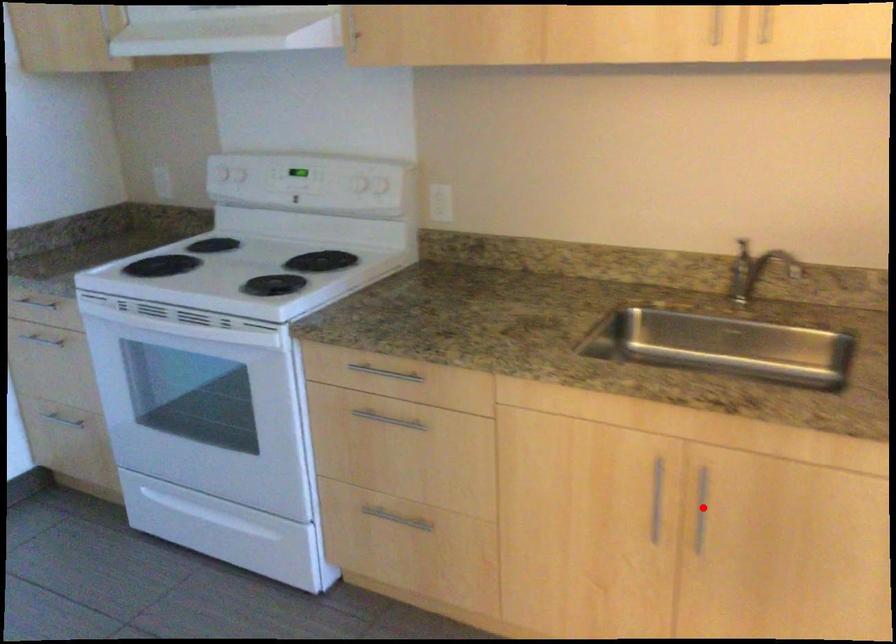
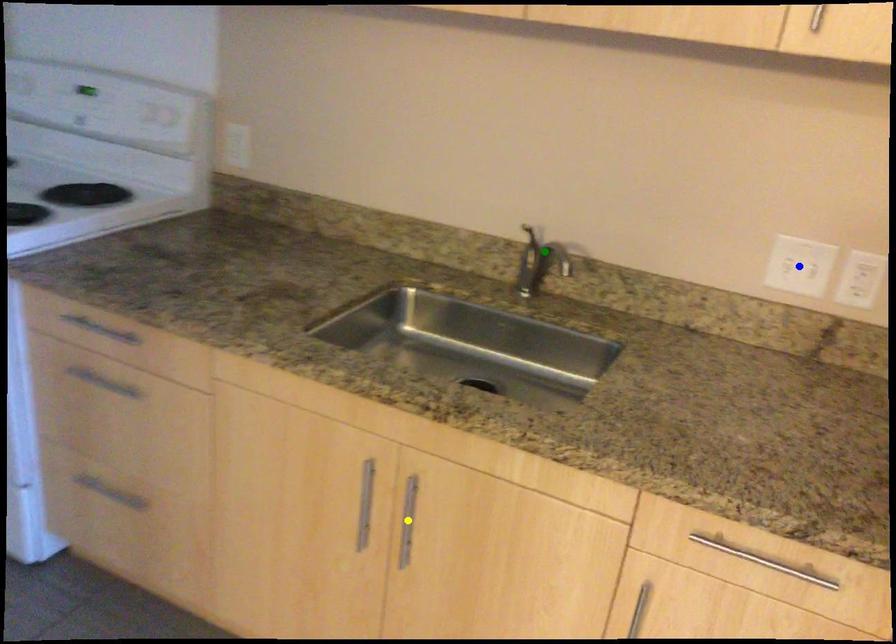
Question: I am providing you with two images of the same scene from different viewpoints. A red point is marked on the first image. You are given multiple points on the second image. Which point in image 2 represents the same 3d spot as the red point in image 1?

Choices:
 (A) yellow point
 (B) green point
 (C) blue point

Answer: (A)